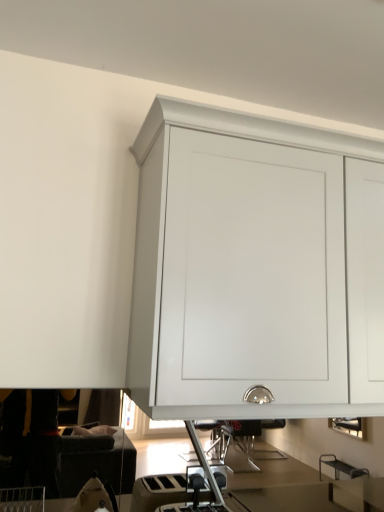
Find the location of a particular element. This screenshot has width=384, height=512. white matte cabinet at upper center is located at coordinates (255, 268).

This screenshot has height=512, width=384. Describe the element at coordinates (255, 268) in the screenshot. I see `white matte cabinet at upper center` at that location.

What is the approximate height of white matte cabinet at upper center?

The height of white matte cabinet at upper center is 35.43 inches.

Where is `white matte cabinet at upper center`? white matte cabinet at upper center is located at coordinates (255, 268).